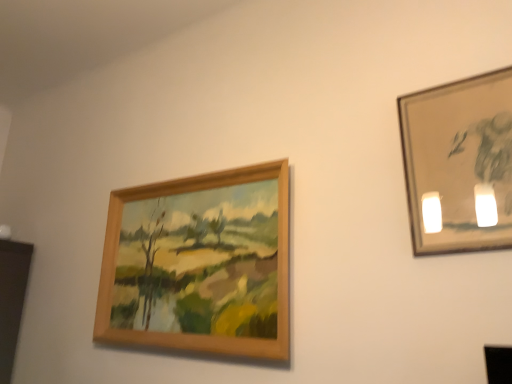
The image size is (512, 384). What do you see at coordinates (200, 264) in the screenshot? I see `wooden frame at upper left, the first picture frame from the back` at bounding box center [200, 264].

The height and width of the screenshot is (384, 512). I want to click on wooden frame at upper left, arranged as the 2th picture frame when viewed from the right, so click(200, 264).

Image resolution: width=512 pixels, height=384 pixels. What do you see at coordinates (459, 164) in the screenshot? I see `metallic silver frame at upper right, the 2th picture frame viewed from the back` at bounding box center [459, 164].

Based on the photo, how much space does metallic silver frame at upper right, marked as the first picture frame in a front-to-back arrangement, occupy vertically?

It is 22.29 inches.

Where is `metallic silver frame at upper right, the 1th picture frame when ordered from right to left`? Image resolution: width=512 pixels, height=384 pixels. metallic silver frame at upper right, the 1th picture frame when ordered from right to left is located at coordinates (459, 164).

The width and height of the screenshot is (512, 384). In order to click on wooden frame at upper left, which is the first picture frame in left-to-right order in this screenshot , I will do pos(200,264).

Considering the relative positions of metallic silver frame at upper right, the 2th picture frame viewed from the back, and wooden frame at upper left, arranged as the 2th picture frame when viewed from the right, in the image provided, is metallic silver frame at upper right, the 2th picture frame viewed from the back, to the right of wooden frame at upper left, arranged as the 2th picture frame when viewed from the right, from the viewer's perspective?

Yes.

Is metallic silver frame at upper right, the 2th picture frame viewed from the back, in front of or behind wooden frame at upper left, which is the first picture frame in left-to-right order, in the image?

metallic silver frame at upper right, the 2th picture frame viewed from the back, is in front of wooden frame at upper left, which is the first picture frame in left-to-right order.

Is point (490, 217) positioned after point (285, 292)?

No, (490, 217) is in front of (285, 292).

From the image's perspective, between metallic silver frame at upper right, the 1th picture frame when ordered from right to left, and wooden frame at upper left, arranged as the 2th picture frame when viewed from the right, which one is located above?

metallic silver frame at upper right, the 1th picture frame when ordered from right to left, appears higher in the image.

From a real-world perspective, is metallic silver frame at upper right, the 1th picture frame when ordered from right to left, on wooden frame at upper left, the 2th picture frame positioned from the front?

Indeed, from a real-world perspective, metallic silver frame at upper right, the 1th picture frame when ordered from right to left, stands above wooden frame at upper left, the 2th picture frame positioned from the front.

Considering the relative sizes of metallic silver frame at upper right, the 1th picture frame when ordered from right to left, and wooden frame at upper left, arranged as the 2th picture frame when viewed from the right, in the image provided, is metallic silver frame at upper right, the 1th picture frame when ordered from right to left, thinner than wooden frame at upper left, arranged as the 2th picture frame when viewed from the right,?

Yes.

Which of these two, metallic silver frame at upper right, marked as the first picture frame in a front-to-back arrangement, or wooden frame at upper left, which is the first picture frame in left-to-right order, stands shorter?

With less height is metallic silver frame at upper right, marked as the first picture frame in a front-to-back arrangement.

Looking at the image, does metallic silver frame at upper right, the 2th picture frame viewed from the back, seem bigger or smaller compared to wooden frame at upper left, arranged as the 2th picture frame when viewed from the right?

Considering their sizes, metallic silver frame at upper right, the 2th picture frame viewed from the back, takes up less space than wooden frame at upper left, arranged as the 2th picture frame when viewed from the right.

Choose the correct answer: Is metallic silver frame at upper right, the 2th picture frame viewed from the back, inside wooden frame at upper left, the 2th picture frame positioned from the front, or outside it?

metallic silver frame at upper right, the 2th picture frame viewed from the back, cannot be found inside wooden frame at upper left, the 2th picture frame positioned from the front.

Can you see metallic silver frame at upper right, the 2th picture frame viewed from the back, touching wooden frame at upper left, which is the first picture frame in left-to-right order?

No, metallic silver frame at upper right, the 2th picture frame viewed from the back, is not touching wooden frame at upper left, which is the first picture frame in left-to-right order.

Is metallic silver frame at upper right, the 1th picture frame when ordered from right to left, looking in the opposite direction of wooden frame at upper left, arranged as the 2th picture frame when viewed from the right?

No, metallic silver frame at upper right, the 1th picture frame when ordered from right to left, is not facing away from wooden frame at upper left, arranged as the 2th picture frame when viewed from the right.

Based on the photo, could you measure the distance between metallic silver frame at upper right, the second picture frame from the left, and wooden frame at upper left, which is the first picture frame in left-to-right order?

metallic silver frame at upper right, the second picture frame from the left, and wooden frame at upper left, which is the first picture frame in left-to-right order, are 30.13 inches apart.

Locate an element on the screen. picture frame above the wooden frame at upper left, arranged as the 2th picture frame when viewed from the right (from a real-world perspective) is located at coordinates (459, 164).

From the picture: Considering the relative positions of wooden frame at upper left, the 2th picture frame positioned from the front, and metallic silver frame at upper right, marked as the first picture frame in a front-to-back arrangement, in the image provided, is wooden frame at upper left, the 2th picture frame positioned from the front, to the left or to the right of metallic silver frame at upper right, marked as the first picture frame in a front-to-back arrangement,?

wooden frame at upper left, the 2th picture frame positioned from the front, is to the left of metallic silver frame at upper right, marked as the first picture frame in a front-to-back arrangement.

Is wooden frame at upper left, which is the first picture frame in left-to-right order, positioned before metallic silver frame at upper right, the 2th picture frame viewed from the back?

No.

Which is further, (244, 239) or (464, 222)?

Positioned behind is point (244, 239).

From the image's perspective, is wooden frame at upper left, arranged as the 2th picture frame when viewed from the right, above metallic silver frame at upper right, the 2th picture frame viewed from the back?

No, from the image's perspective, wooden frame at upper left, arranged as the 2th picture frame when viewed from the right, is not over metallic silver frame at upper right, the 2th picture frame viewed from the back.

From a real-world perspective, is wooden frame at upper left, the first picture frame from the back, above or below metallic silver frame at upper right, the 2th picture frame viewed from the back?

From a real-world perspective, wooden frame at upper left, the first picture frame from the back, is physically below metallic silver frame at upper right, the 2th picture frame viewed from the back.

Is wooden frame at upper left, arranged as the 2th picture frame when viewed from the right, wider than metallic silver frame at upper right, the second picture frame from the left?

Yes.

From the picture: In terms of height, does wooden frame at upper left, which is the first picture frame in left-to-right order, look taller or shorter compared to metallic silver frame at upper right, the 2th picture frame viewed from the back?

Considering their sizes, wooden frame at upper left, which is the first picture frame in left-to-right order, has more height than metallic silver frame at upper right, the 2th picture frame viewed from the back.

Is wooden frame at upper left, the first picture frame from the back, bigger than metallic silver frame at upper right, the 1th picture frame when ordered from right to left?

Indeed, wooden frame at upper left, the first picture frame from the back, has a larger size compared to metallic silver frame at upper right, the 1th picture frame when ordered from right to left.

Is wooden frame at upper left, the first picture frame from the back, positioned beyond the bounds of metallic silver frame at upper right, the 2th picture frame viewed from the back?

Yes.

Are wooden frame at upper left, the first picture frame from the back, and metallic silver frame at upper right, marked as the first picture frame in a front-to-back arrangement, far apart?

Actually, wooden frame at upper left, the first picture frame from the back, and metallic silver frame at upper right, marked as the first picture frame in a front-to-back arrangement, are a little close together.

In the scene shown: Is wooden frame at upper left, which is the first picture frame in left-to-right order, turned away from metallic silver frame at upper right, marked as the first picture frame in a front-to-back arrangement?

wooden frame at upper left, which is the first picture frame in left-to-right order, does not have its back to metallic silver frame at upper right, marked as the first picture frame in a front-to-back arrangement.

What's the angular difference between wooden frame at upper left, arranged as the 2th picture frame when viewed from the right, and metallic silver frame at upper right, the 1th picture frame when ordered from right to left,'s facing directions?

There is a 0.76-degree angle between the facing directions of wooden frame at upper left, arranged as the 2th picture frame when viewed from the right, and metallic silver frame at upper right, the 1th picture frame when ordered from right to left.

Locate an element on the screen. The height and width of the screenshot is (384, 512). picture frame below the metallic silver frame at upper right, marked as the first picture frame in a front-to-back arrangement (from the image's perspective) is located at coordinates [200, 264].

Where is `picture frame above the wooden frame at upper left, the 2th picture frame positioned from the front (from a real-world perspective)`? picture frame above the wooden frame at upper left, the 2th picture frame positioned from the front (from a real-world perspective) is located at coordinates (459, 164).

Find the location of `picture frame in front of the wooden frame at upper left, the first picture frame from the back`. picture frame in front of the wooden frame at upper left, the first picture frame from the back is located at coordinates (459, 164).